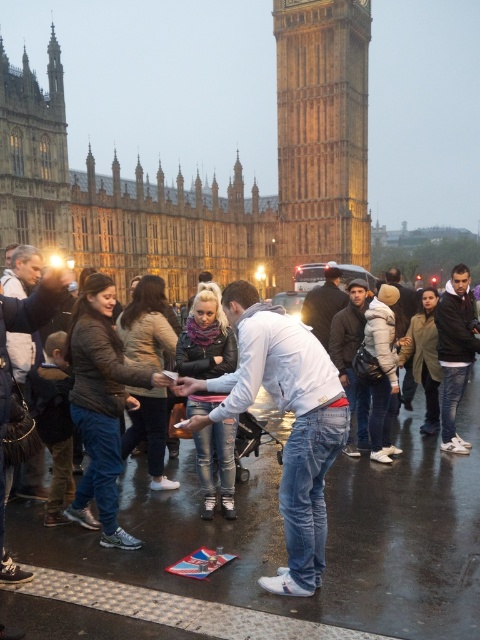
Between ripped denim jeans at center and white fleece jacket at center, which one has more height?

Standing taller between the two is ripped denim jeans at center.

Which is in front, point (232, 356) or point (386, 323)?

Point (232, 356)

The width and height of the screenshot is (480, 640). I want to click on ripped denim jeans at center, so click(x=205, y=337).

Does brown stone tower at upper center appear over white fleece jacket at center?

Yes.

Who is taller, brown stone tower at upper center or white fleece jacket at center?

brown stone tower at upper center is taller.

Image resolution: width=480 pixels, height=640 pixels. Describe the element at coordinates (322, 131) in the screenshot. I see `brown stone tower at upper center` at that location.

What are the coordinates of `brown stone tower at upper center` in the screenshot? It's located at (322, 131).

Between denim jacket at lower left and white fleece jacket at center, which one has less height?

With less height is white fleece jacket at center.

Locate an element on the screen. denim jacket at lower left is located at coordinates (100, 404).